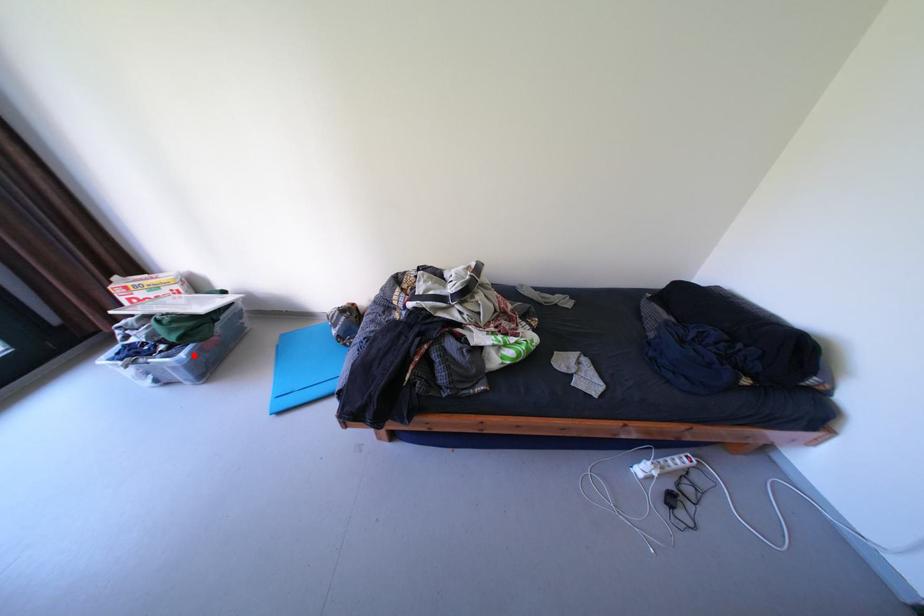
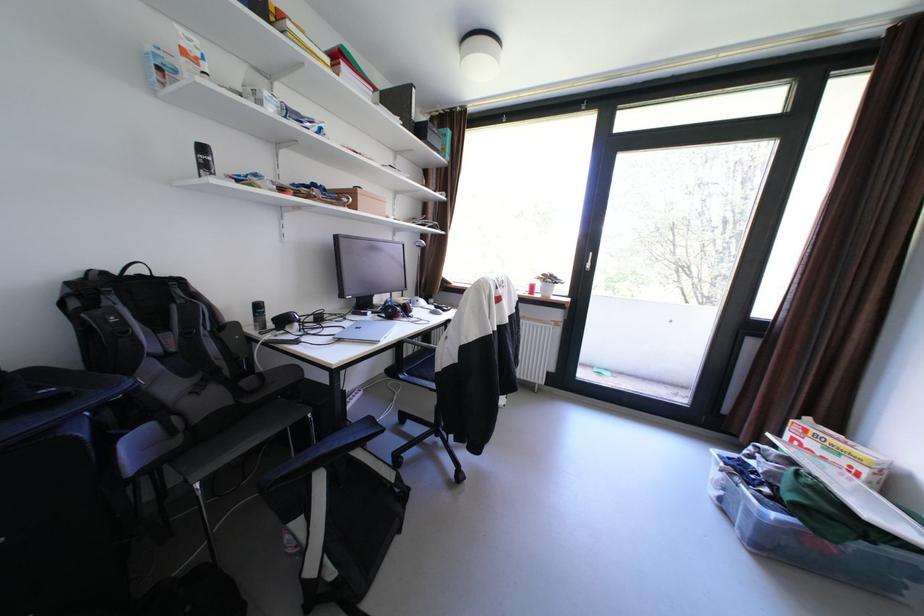
Find the pixel in the second image that matches the highlighted location in the first image.

(784, 516)